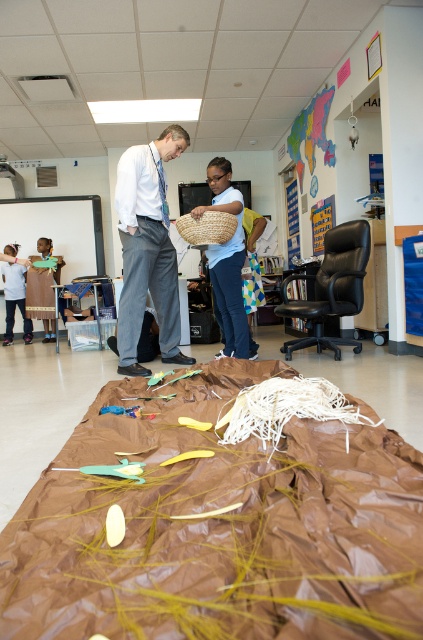
You are a teacher in the classroom and want to place a small toy that is 3 feet long between the brown paper bag at center and the white cotton pants at center. Will there be enough space between them to fit the toy?

The distance between the brown paper bag at center and the white cotton pants at center is 5.78 feet. Since the toy is 3 feet long, there is sufficient space to place it between them.